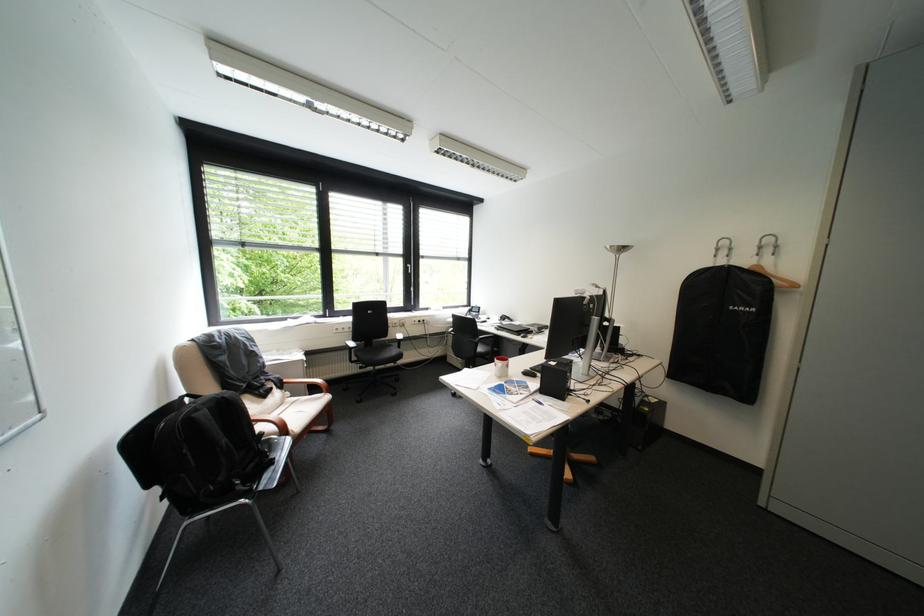
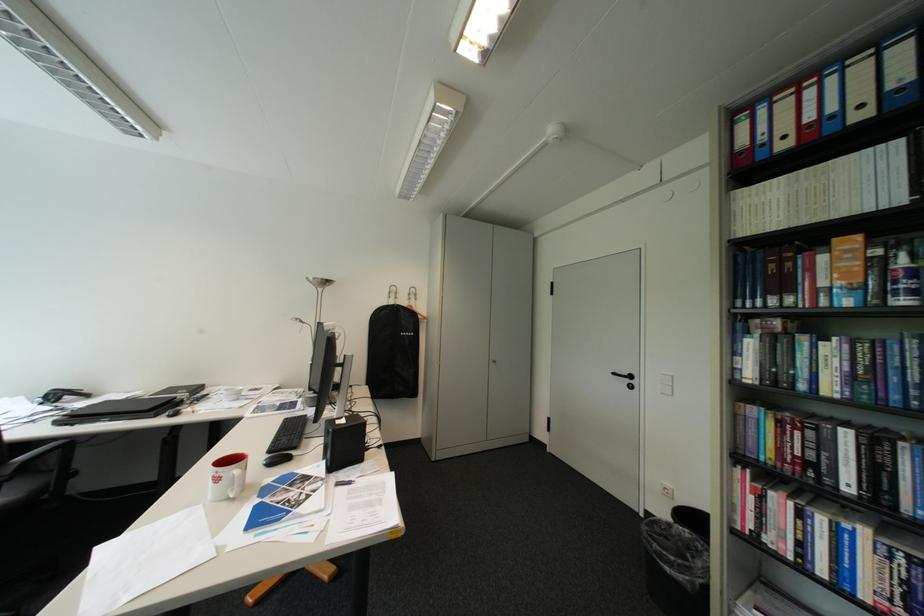
In the second image, find the point that corresponds to pixel 743 249 in the first image.

(408, 294)